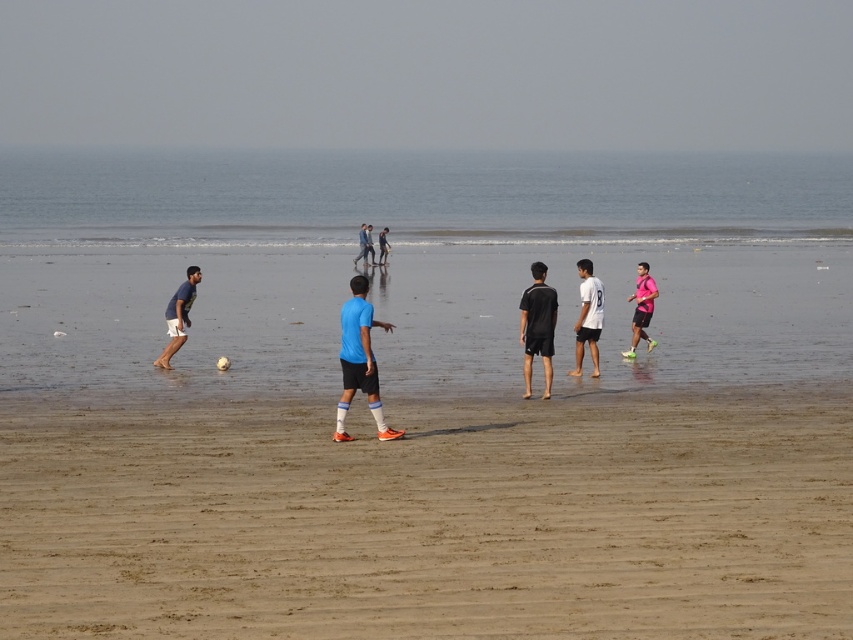
Who is higher up, brown sandy beach at center or blue matte soccer ball at center?

brown sandy beach at center is above.

What do you see at coordinates (425, 449) in the screenshot?
I see `brown sandy beach at center` at bounding box center [425, 449].

Does point (419, 429) come closer to viewer compared to point (392, 435)?

No, it is behind (392, 435).

Locate an element on the screen. brown sandy beach at center is located at coordinates pos(425,449).

Can you confirm if white matte shirt at center is positioned to the right of blue fabric pants at center?

Indeed, white matte shirt at center is positioned on the right side of blue fabric pants at center.

Is white matte shirt at center to the left of blue fabric pants at center from the viewer's perspective?

Incorrect, white matte shirt at center is not on the left side of blue fabric pants at center.

You are a GUI agent. You are given a task and a screenshot of the screen. Output one action in this format:
    pyautogui.click(x=<x>, y=<y>)
    Task: Click on the white matte shirt at center
    The image size is (853, 640).
    Given the screenshot: What is the action you would take?
    pyautogui.click(x=587, y=317)

Between point (358, 332) and point (590, 298), which one is positioned behind?

The point (590, 298) is more distant.

Can you confirm if blue matte soccer ball at center is positioned below white matte shirt at center?

Indeed, blue matte soccer ball at center is positioned under white matte shirt at center.

You are a GUI agent. You are given a task and a screenshot of the screen. Output one action in this format:
    pyautogui.click(x=<x>, y=<y>)
    Task: Click on the blue matte soccer ball at center
    
    Given the screenshot: What is the action you would take?
    tap(358, 360)

This screenshot has height=640, width=853. I want to click on blue matte soccer ball at center, so click(358, 360).